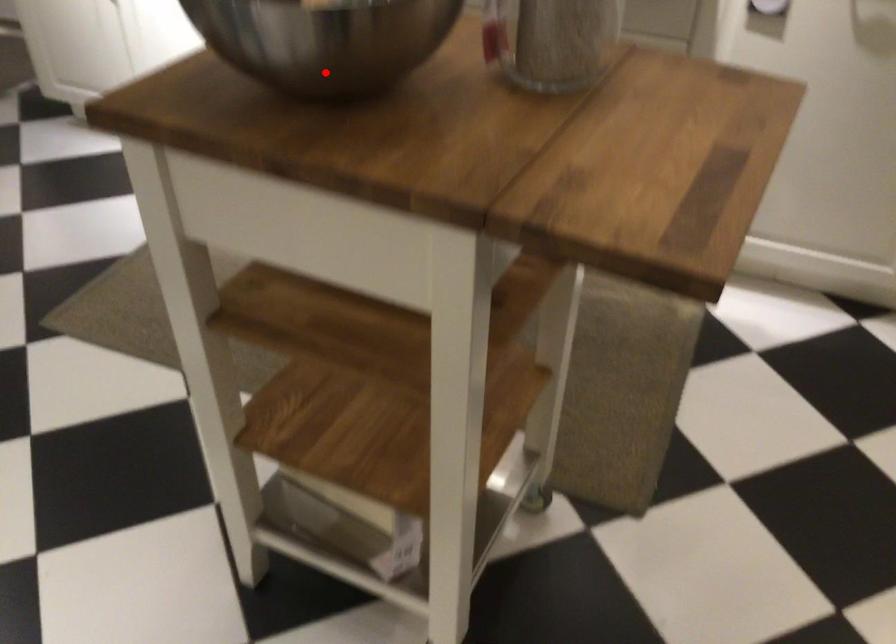
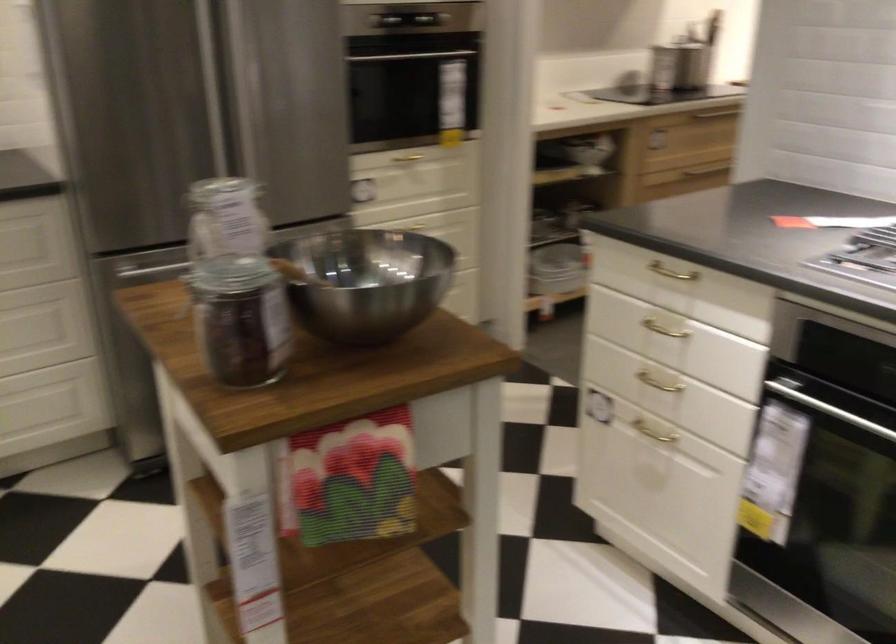
Question: A red point is marked in image1. In image2, is the corresponding 3D point closer to the camera or farther? Reply with the corresponding letter.

Choices:
 (A) The corresponding 3D point is closer.
 (B) The corresponding 3D point is farther.

Answer: (B)